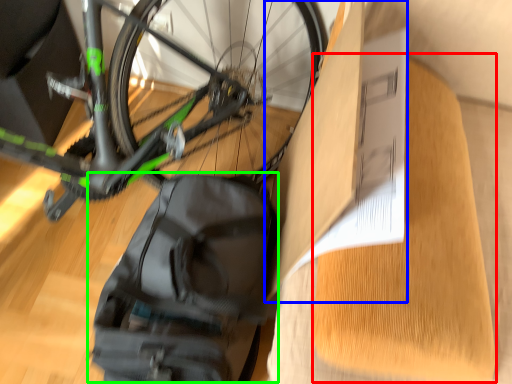
Question: Based on their relative distances, which object is farther from cardboard (highlighted by a red box)? Choose from cardboard box (highlighted by a blue box) and backpack (highlighted by a green box).

Choices:
 (A) cardboard box
 (B) backpack

Answer: (B)